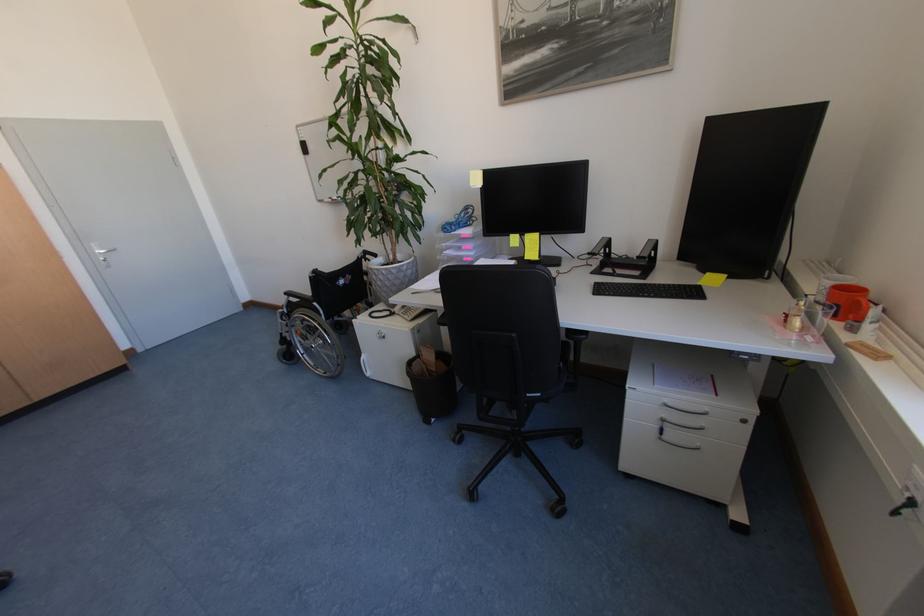
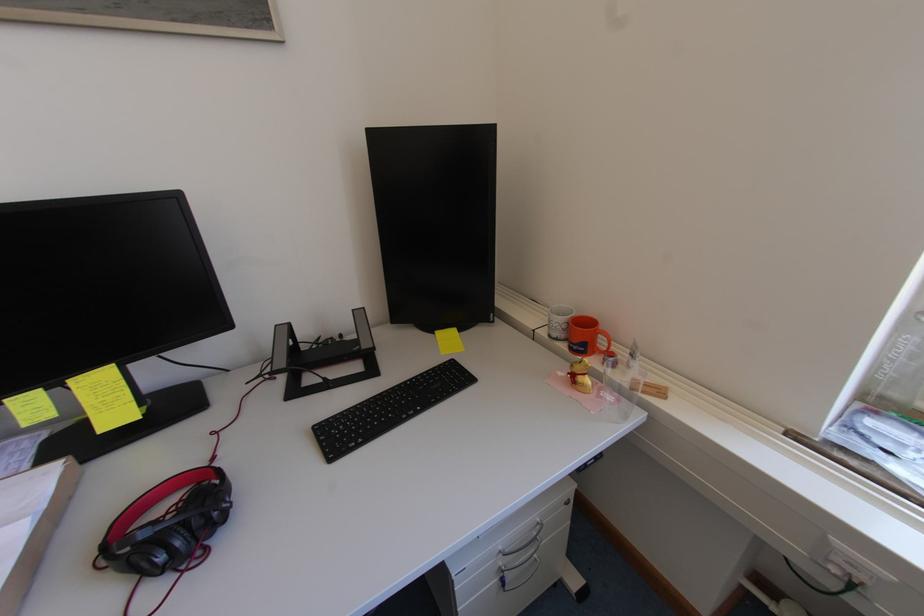
Question: The camera is either moving clockwise (left) or counter-clockwise (right) around the object. The first image is from the beginning of the video and the second image is from the end. Is the camera moving left or right when shooting the video?

Choices:
 (A) Left
 (B) Right

Answer: (A)